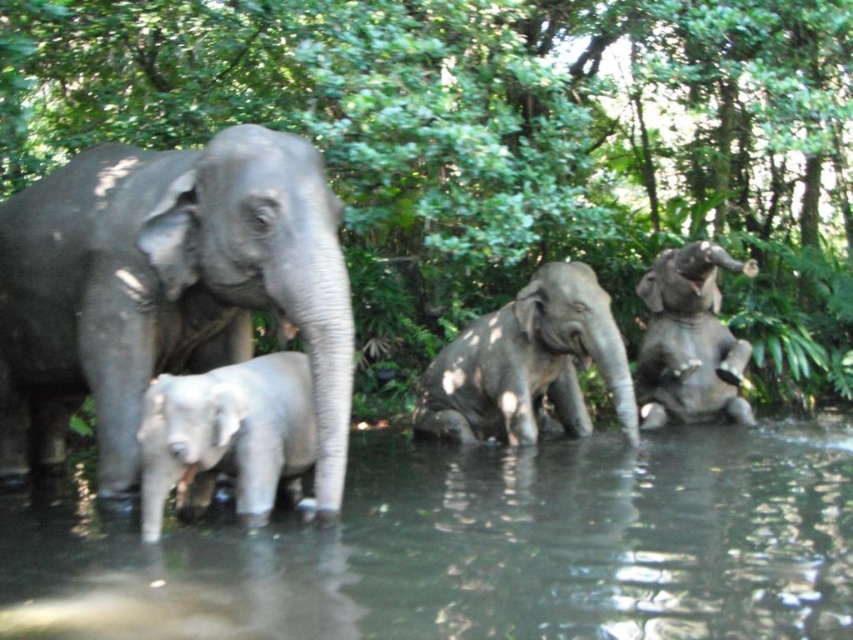
You are observing a group of elephants in a natural setting. You see the gray matte elephant at center and the gray matte elephant at lower left. Which elephant is positioned higher in the image?

The gray matte elephant at center is positioned higher in the image than the gray matte elephant at lower left.

You are observing the elephants at the creek. Which object, the clear water at creek left or the gray matte elephant at lower left, is higher in position?

The gray matte elephant at lower left is higher in position because the clear water at creek left is shorter than it.